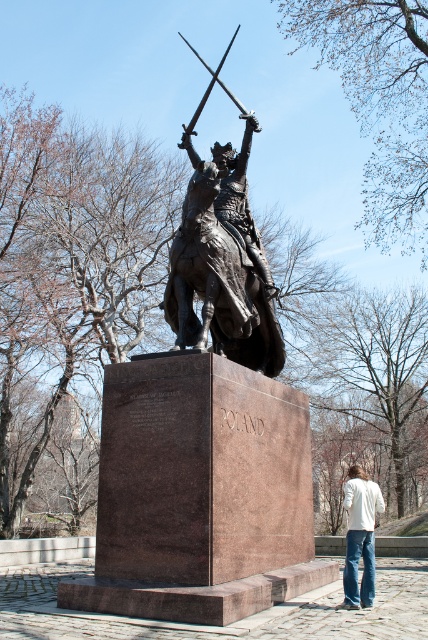
Can you confirm if bronze statue at center is bigger than white cotton shirt at lower right?

Indeed, bronze statue at center has a larger size compared to white cotton shirt at lower right.

Does bronze statue at center appear on the right side of white cotton shirt at lower right?

In fact, bronze statue at center is to the left of white cotton shirt at lower right.

Measure the distance between point (243, 317) and camera.

A: Point (243, 317) and camera are 56.80 feet apart.

Identify the location of bronze statue at center. This screenshot has height=640, width=428. (222, 259).